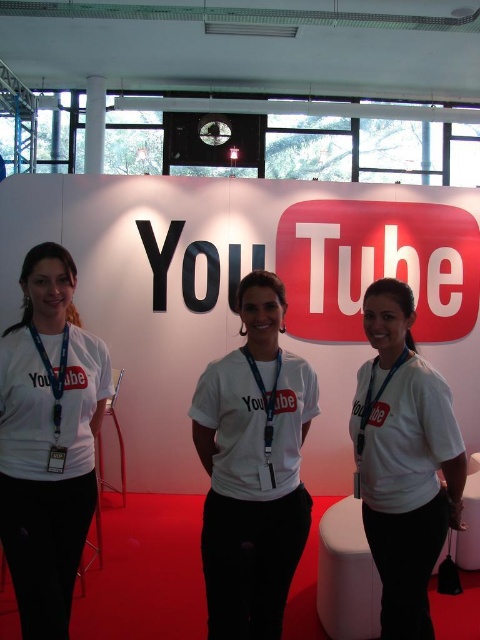
Question: Which is farther from the white cotton t-shirt at center?

Choices:
 (A) white fabric stool at lower center
 (B) metallic vip card at lower left
 (C) white cotton shirt at center

Answer: (A)

Question: Can you confirm if white matte t-shirt at center is positioned to the right of white cotton shirt at center?

Choices:
 (A) no
 (B) yes

Answer: (A)

Question: Which point is closer to the camera taking this photo?

Choices:
 (A) (428, 568)
 (B) (47, 285)

Answer: (B)

Question: Is white matte t-shirt at center bigger than metallic vip card at lower left?

Choices:
 (A) no
 (B) yes

Answer: (B)

Question: Where is white fabric stool at lower center located in relation to metallic vip card at lower left in the image?

Choices:
 (A) right
 (B) left

Answer: (A)

Question: Which object is positioned farthest from the white cotton t-shirt at center?

Choices:
 (A) white cotton shirt at center
 (B) white fabric stool at lower center

Answer: (B)